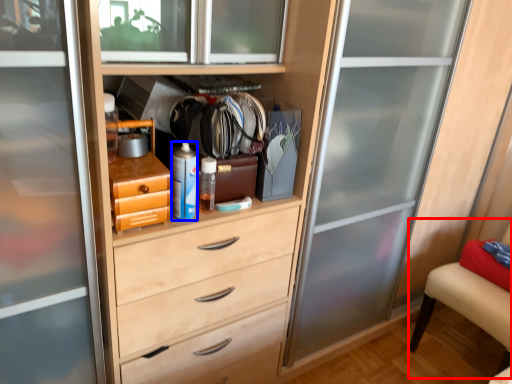
Question: Among these objects, which one is nearest to the camera, armchair (highlighted by a red box) or bottle (highlighted by a blue box)?

Choices:
 (A) armchair
 (B) bottle

Answer: (B)